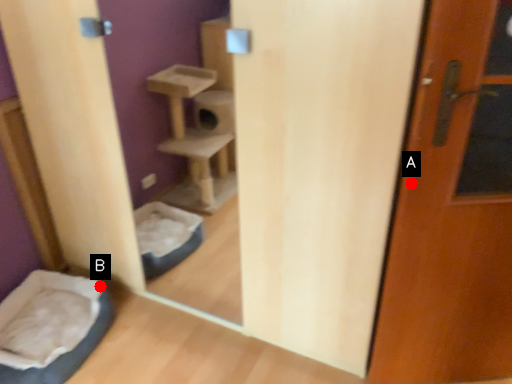
Question: Two points are circled on the image, labeled by A and B beside each circle. Which point is closer to the camera?

Choices:
 (A) A is closer
 (B) B is closer

Answer: (A)